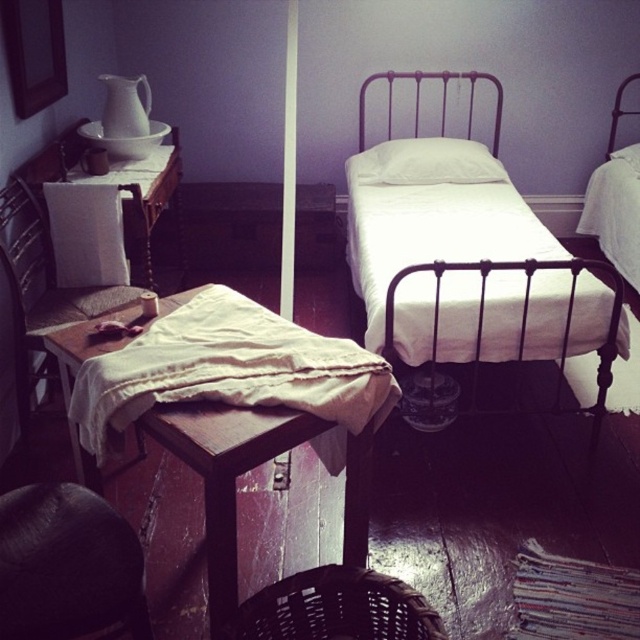
Is wooden woven chair at left to the right of white soft pillow at center from the viewer's perspective?

No, wooden woven chair at left is not to the right of white soft pillow at center.

Between wooden woven chair at left and white soft pillow at center, which one is positioned higher?

Positioned higher is white soft pillow at center.

Who is more forward, (84,301) or (400,157)?

Point (84,301) is in front.

At what (x,y) coordinates should I click in order to perform the action: click on wooden woven chair at left. Please return your answer as a coordinate pair (x, y). This screenshot has width=640, height=640. Looking at the image, I should click on (42, 285).

Does point (627, 196) lie behind point (468, 150)?

No, it is not.

Between white cotton bed at center and white soft pillow at center, which one is positioned higher?

Positioned higher is white soft pillow at center.

What do you see at coordinates (618, 244) in the screenshot? I see `white cotton bed at center` at bounding box center [618, 244].

I want to click on white cotton bed at center, so click(x=618, y=244).

Does woven brown chair at lower center have a greater height compared to white cotton pillow at center?

In fact, woven brown chair at lower center may be shorter than white cotton pillow at center.

Consider the image. Which of these two, woven brown chair at lower center or white cotton pillow at center, stands taller?

Standing taller between the two is white cotton pillow at center.

I want to click on woven brown chair at lower center, so click(337, 609).